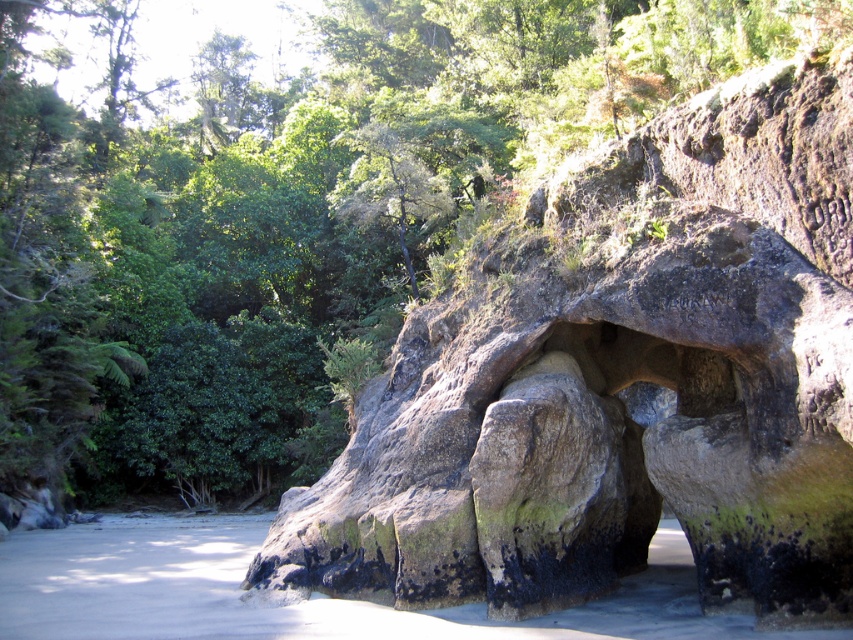
Is rough textured rock at center shorter than green leafy tree at center?

Yes, rough textured rock at center is shorter than green leafy tree at center.

Is point (685, 368) behind point (413, 184)?

That is False.

The image size is (853, 640). I want to click on rough textured rock at center, so click(619, 384).